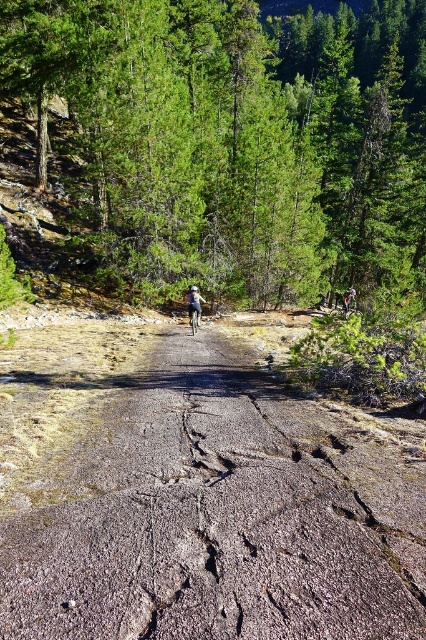
You are a hiker navigating a mountain biking trail. You come across a point marked at coordinates (226,516). What feature is located at this point?

The brown cracked dirt at center is located at point (226,516).

You are a hiker navigating a mountain biking trail. You see a point marked at coordinates [235,138]. What object is located at that point?

The point at coordinates [235,138] marks a green leafy tree at center.